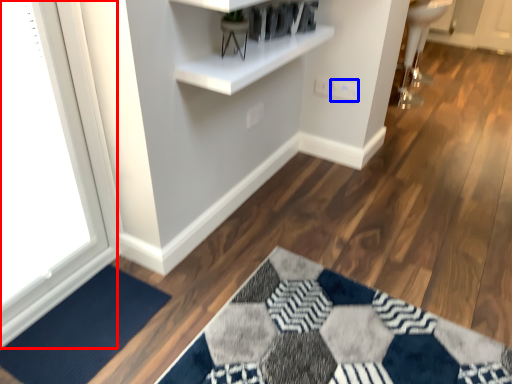
Question: Among these objects, which one is farthest to the camera, window (highlighted by a red box) or electric outlet (highlighted by a blue box)?

Choices:
 (A) window
 (B) electric outlet

Answer: (B)